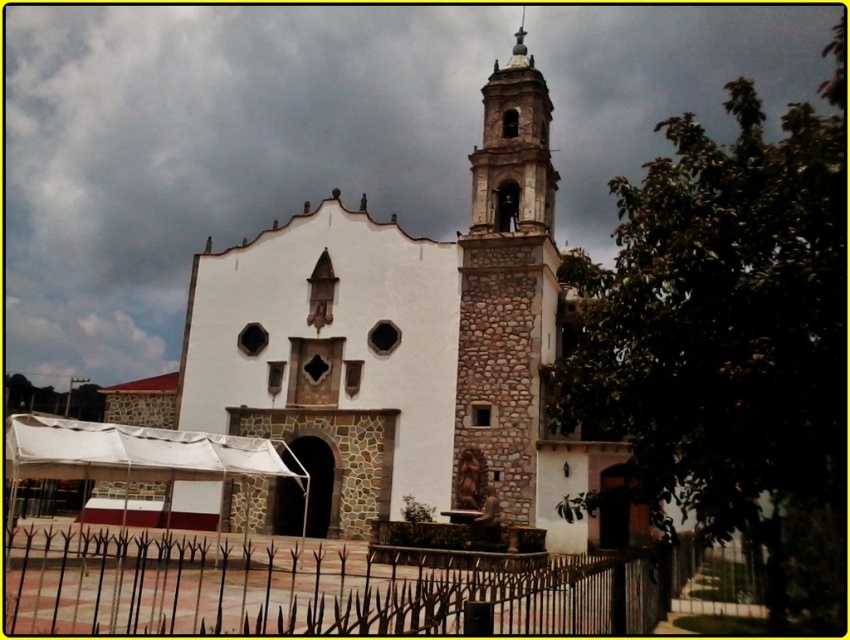
Question: Does black wrought iron fence at lower center have a larger size compared to stone textured tower at center?

Choices:
 (A) yes
 (B) no

Answer: (B)

Question: Does black wrought iron fence at lower center have a smaller size compared to stone textured tower at center?

Choices:
 (A) yes
 (B) no

Answer: (A)

Question: Is black wrought iron fence at lower center to the right of stone textured tower at center from the viewer's perspective?

Choices:
 (A) yes
 (B) no

Answer: (B)